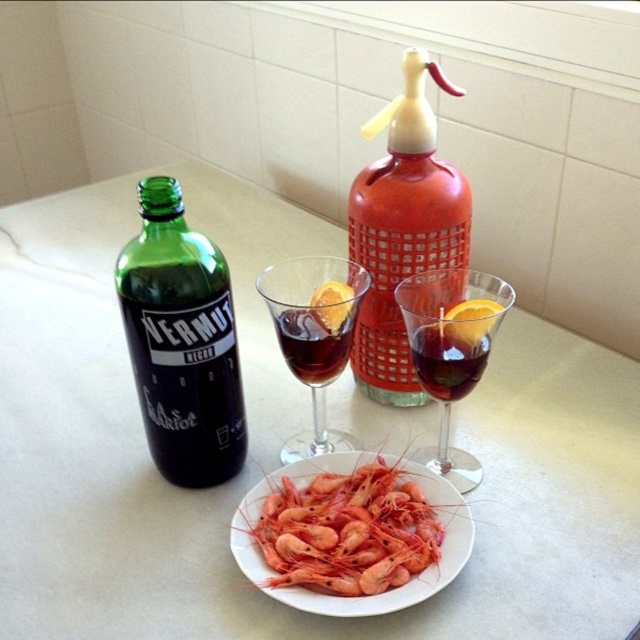
Question: Can you confirm if white glossy table at center is thinner than dark red glass at center?

Choices:
 (A) yes
 (B) no

Answer: (B)

Question: Which of the following is the closest to the observer?

Choices:
 (A) translucent glass wine glass at center
 (B) transparent glass wine glass at center
 (C) white glossy table at center
 (D) matte glass bottle at center

Answer: (C)

Question: In this image, where is matte glass bottle at center located relative to transparent glass wine glass at center?

Choices:
 (A) right
 (B) left

Answer: (A)

Question: Can you confirm if translucent glass wine glass at center is wider than dark red glass at center?

Choices:
 (A) no
 (B) yes

Answer: (B)

Question: Which point appears farthest from the camera in this image?

Choices:
 (A) (141, 403)
 (B) (378, 611)
 (C) (465, 333)
 (D) (428, 378)

Answer: (A)

Question: Which object is positioned closest to the dark red glass at center?

Choices:
 (A) transparent glass wine glass at center
 (B) matte glass bottle at center

Answer: (A)